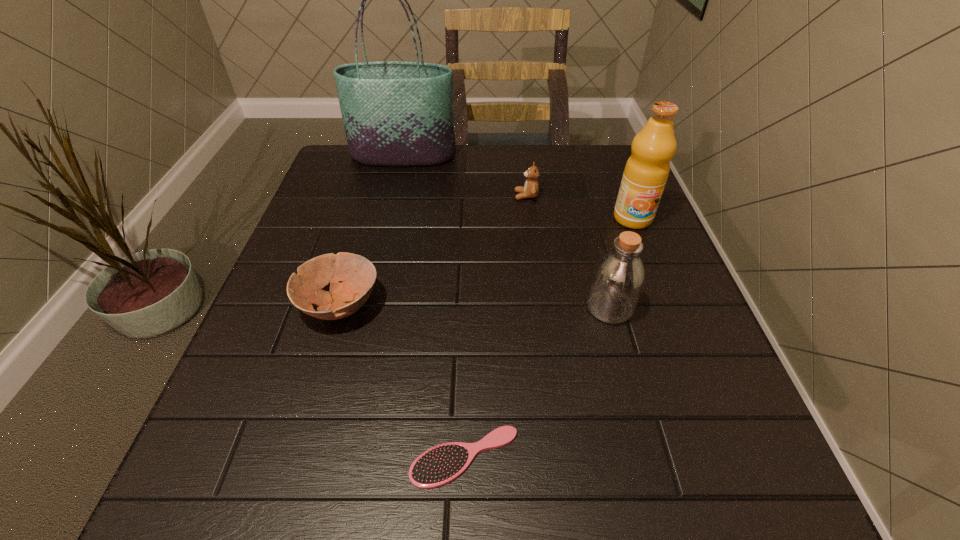
Image resolution: width=960 pixels, height=540 pixels. Identify the location of the tallest object. (395, 113).

Locate an element on the screen. the farthest object is located at coordinates (395, 113).

Locate an element on the screen. This screenshot has width=960, height=540. fruit juice is located at coordinates (646, 172).

Where is `the rightmost object`? The image size is (960, 540). the rightmost object is located at coordinates (646, 172).

You are a GUI agent. You are given a task and a screenshot of the screen. Output one action in this format:
    pyautogui.click(x=<x>, y=<y>)
    Task: Click on the second object from right to left
    
    Given the screenshot: What is the action you would take?
    pyautogui.click(x=618, y=278)

Image resolution: width=960 pixels, height=540 pixels. In order to click on the fourth shortest object in this screenshot , I will do `click(618, 278)`.

The width and height of the screenshot is (960, 540). Find the location of `teddy bear`. teddy bear is located at coordinates (531, 188).

I want to click on the fourth object from left to right, so click(x=531, y=188).

In order to click on the fifth tallest object in this screenshot , I will do `click(358, 275)`.

Where is `hairbrush`? hairbrush is located at coordinates (439, 465).